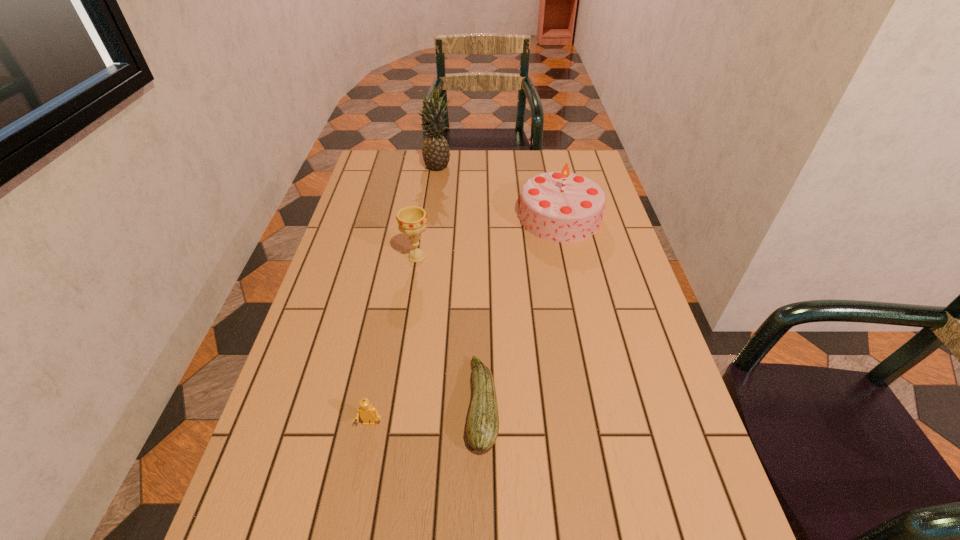
This screenshot has height=540, width=960. Find the location of `the farthest object`. the farthest object is located at coordinates (435, 151).

The height and width of the screenshot is (540, 960). Identify the location of pineapple. (435, 151).

Identify the location of the rightmost object. (564, 207).

This screenshot has width=960, height=540. In order to click on the fourth shortest object in this screenshot , I will do `click(564, 207)`.

You are a GUI agent. You are given a task and a screenshot of the screen. Output one action in this format:
    pyautogui.click(x=<x>, y=<y>)
    Task: Click on the third nearest object
    Image resolution: width=960 pixels, height=540 pixels.
    Given the screenshot: What is the action you would take?
    pyautogui.click(x=412, y=220)

Where is `the third tallest object`? The image size is (960, 540). the third tallest object is located at coordinates (412, 220).

Locate an element on the screen. Lego is located at coordinates (369, 414).

Where is `the second object from right to left`? the second object from right to left is located at coordinates (482, 429).

The height and width of the screenshot is (540, 960). I want to click on the shortest object, so click(x=482, y=429).

This screenshot has width=960, height=540. Identify the location of free space located on the right of the farthest object. (506, 166).